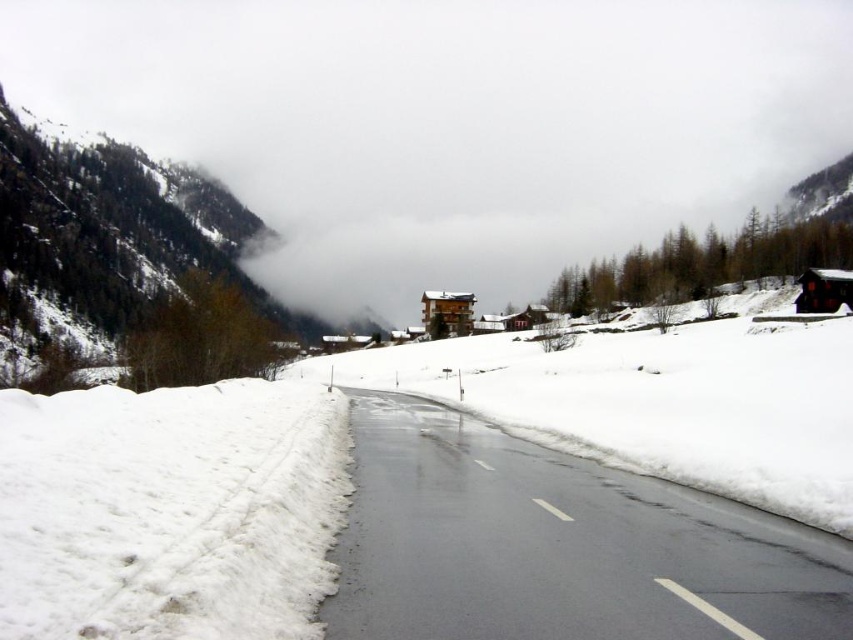
Question: Which object appears farthest from the camera in this image?

Choices:
 (A) snowy forested mountain at left
 (B) white fluffy snow at lower left
 (C) black asphalt road at center
 (D) white fluffy cloud at upper center

Answer: (D)

Question: Does black asphalt road at center have a greater width compared to white fluffy snow at lower left?

Choices:
 (A) no
 (B) yes

Answer: (B)

Question: Based on their relative distances, which object is farther from the white fluffy snow at lower left?

Choices:
 (A) white fluffy cloud at upper center
 (B) black asphalt road at center
 (C) snowy forested mountain at left

Answer: (A)

Question: Where is white fluffy cloud at upper center located in relation to black asphalt road at center in the image?

Choices:
 (A) right
 (B) left

Answer: (B)

Question: Among these points, which one is nearest to the camera?

Choices:
 (A) (608, 211)
 (B) (140, 156)

Answer: (B)

Question: Considering the relative positions of white fluffy cloud at upper center and snowy forested mountain at left in the image provided, where is white fluffy cloud at upper center located with respect to snowy forested mountain at left?

Choices:
 (A) right
 (B) left

Answer: (A)